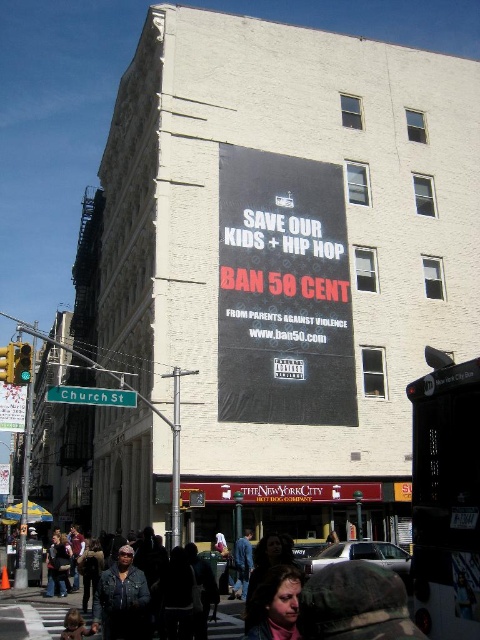
Between black matte poster at center and matte pink scarf at lower center, which one is positioned higher?

Positioned higher is black matte poster at center.

What do you see at coordinates (284, 291) in the screenshot? I see `black matte poster at center` at bounding box center [284, 291].

I want to click on black matte poster at center, so click(284, 291).

Is matte pink scarf at lower center to the right of green metallic street sign at lower left from the viewer's perspective?

Indeed, matte pink scarf at lower center is positioned on the right side of green metallic street sign at lower left.

Can you confirm if matte pink scarf at lower center is thinner than green metallic street sign at lower left?

Yes, matte pink scarf at lower center is thinner than green metallic street sign at lower left.

Who is more forward, (248,608) or (48,387)?

Point (248,608) is in front.

Where is `matte pink scarf at lower center`? The image size is (480, 640). matte pink scarf at lower center is located at coordinates (275, 605).

Is denim jacket at lower center shorter than blue jeans at center?

In fact, denim jacket at lower center may be taller than blue jeans at center.

Who is more distant from viewer, (122, 572) or (252, 563)?

Positioned behind is point (252, 563).

Between point (116, 592) and point (240, 580), which one is positioned behind?

The point (240, 580) is behind.

This screenshot has width=480, height=640. Find the location of `denim jacket at lower center`. denim jacket at lower center is located at coordinates (121, 600).